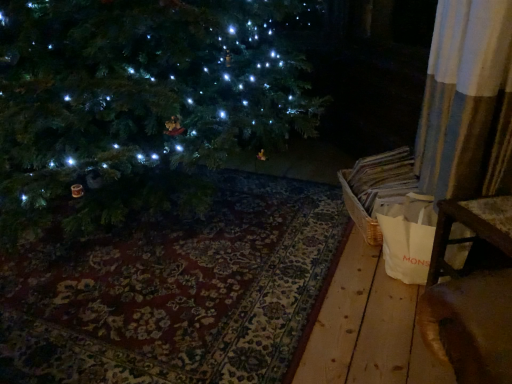
Find the location of a particular element. Image resolution: width=512 pixels, height=384 pixels. white paper bag at right is located at coordinates (359, 212).

This screenshot has height=384, width=512. Describe the element at coordinates (359, 212) in the screenshot. I see `white paper bag at right` at that location.

You are a GUI agent. You are given a task and a screenshot of the screen. Output one action in this format:
    pyautogui.click(x=<x>, y=<y>)
    Task: Click on the white paper bag at right
    This screenshot has width=512, height=384.
    Given the screenshot: What is the action you would take?
    pyautogui.click(x=359, y=212)